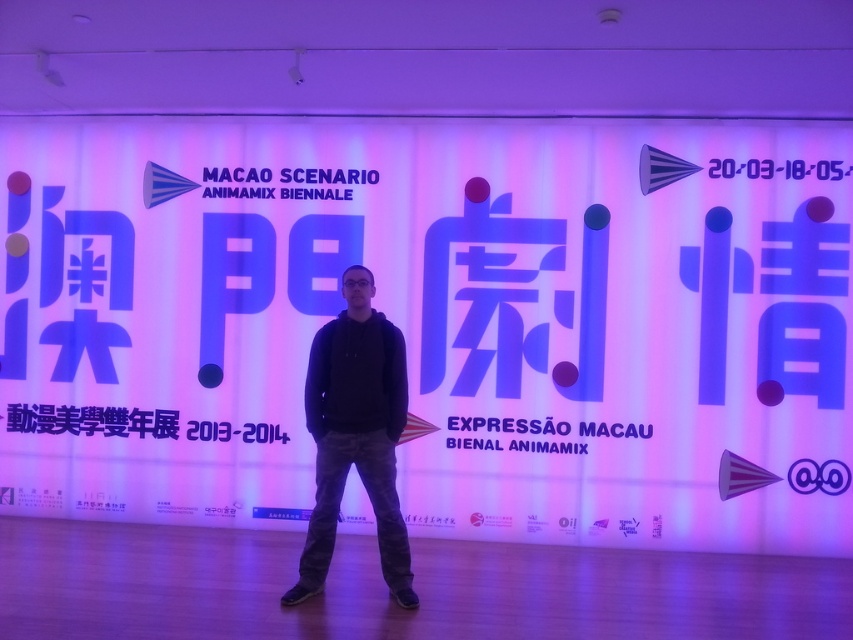
Question: Does white matte sign at center appear on the left side of black cotton hoodie at center?

Choices:
 (A) no
 (B) yes

Answer: (A)

Question: Does white matte sign at center have a smaller size compared to black cotton hoodie at center?

Choices:
 (A) no
 (B) yes

Answer: (A)

Question: Which point is farther to the camera?

Choices:
 (A) (418, 324)
 (B) (402, 424)

Answer: (A)

Question: In this image, where is white matte sign at center located relative to black cotton hoodie at center?

Choices:
 (A) right
 (B) left

Answer: (A)

Question: Which point is closer to the camera?

Choices:
 (A) white matte sign at center
 (B) black cotton hoodie at center

Answer: (B)

Question: Among these objects, which one is farthest from the camera?

Choices:
 (A) white matte sign at center
 (B) black cotton hoodie at center

Answer: (A)